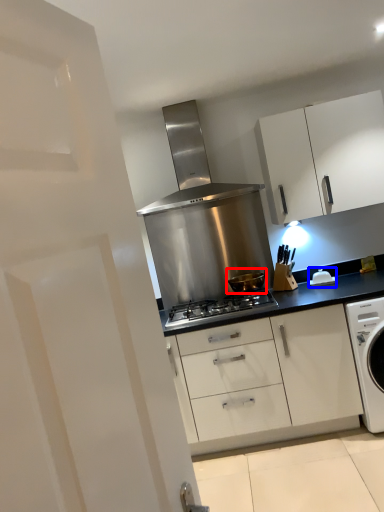
Question: Which object appears closest to the camera in this image, kitchen appliance (highlighted by a red box) or appliance (highlighted by a blue box)?

Choices:
 (A) kitchen appliance
 (B) appliance

Answer: (A)